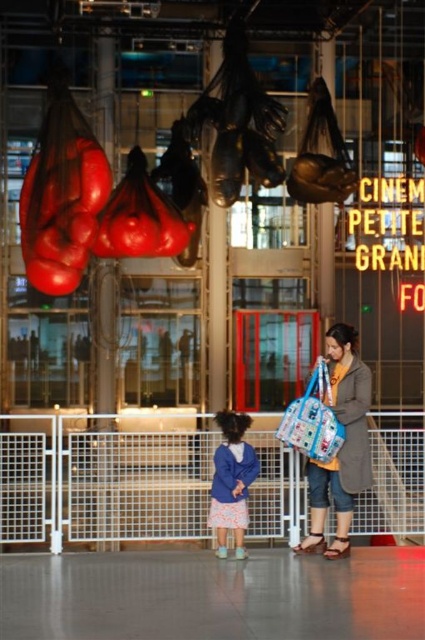
You are an observer in the scene. You see a woman wearing a blue fleece jacket at center and holding a blue fabric bag at center. Which item is taller?

The blue fleece jacket at center is taller than the blue fabric bag at center.

You are a visitor in a museum and you see the white metal fence at lower center and the blue fabric bag at center. Which object is taller?

The white metal fence at lower center is taller than the blue fabric bag at center.

You are an observer in the scene. You see the blue fleece jacket at center and the blue fabric bag at center. Which one is closer to you?

The blue fleece jacket at center is closer to you because the blue fabric bag at center is behind it.